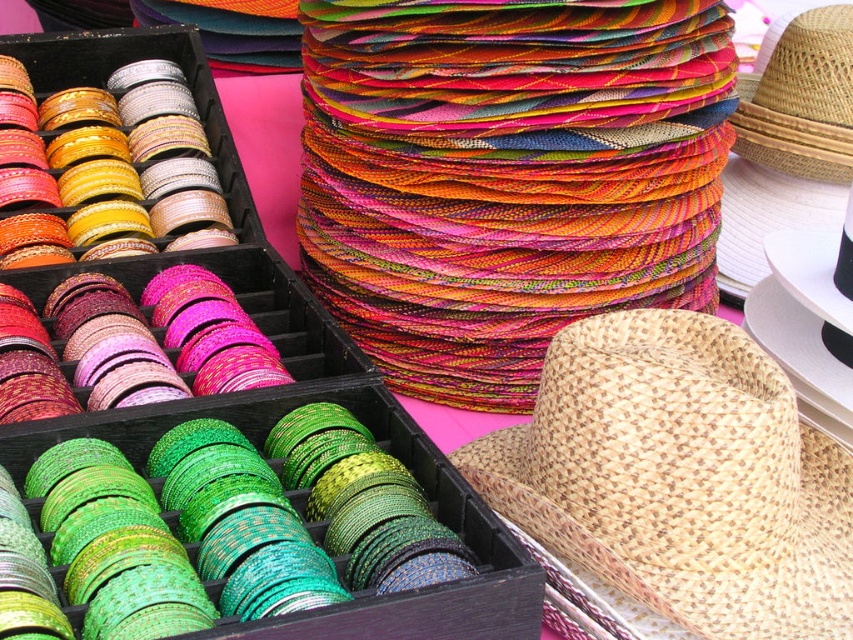
Does point (672, 365) come in front of point (834, 170)?

Yes, it is.

Is natural woven straw hat at lower right wider than natural straw hat at upper right?

Yes.

Who is more distant from viewer, (820, 570) or (802, 164)?

The point (802, 164) is more distant.

Find the location of a particular element. natural woven straw hat at lower right is located at coordinates (679, 477).